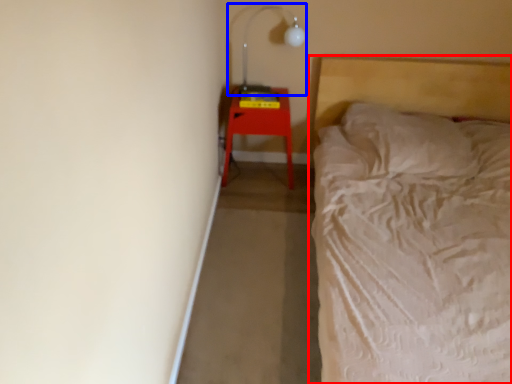
Question: Which object is further to the camera taking this photo, bed (highlighted by a red box) or lamp (highlighted by a blue box)?

Choices:
 (A) bed
 (B) lamp

Answer: (B)